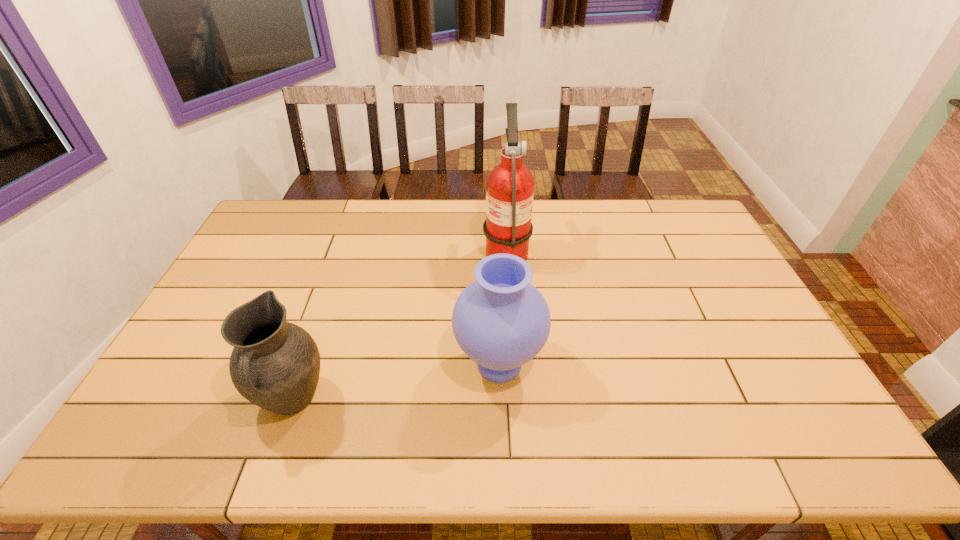
In order to click on blank area at the far edge in this screenshot , I will do `click(560, 215)`.

You are a GUI agent. You are given a task and a screenshot of the screen. Output one action in this format:
    pyautogui.click(x=<x>, y=<y>)
    Task: Click on the free space at the near edge of the desktop
    The image size is (960, 540).
    Given the screenshot: What is the action you would take?
    (x=385, y=427)

I want to click on vacant space at the left edge, so click(x=187, y=391).

This screenshot has width=960, height=540. I want to click on free space at the right edge, so click(x=801, y=415).

Locate an element on the screen. Image resolution: width=960 pixels, height=540 pixels. vacant region at the far left corner of the desktop is located at coordinates (287, 232).

Locate an element on the screen. The height and width of the screenshot is (540, 960). vacant space at the far right corner of the desktop is located at coordinates (663, 222).

Identify the location of blank region between the fire extinguisher and the pitcher. (399, 324).

Where is `free area in between the farthest object and the leftmost object`? The height and width of the screenshot is (540, 960). free area in between the farthest object and the leftmost object is located at coordinates (399, 324).

Identify the location of free space between the tallest object and the leftmost object. (399, 324).

Find the location of a particular element. vacant point located between the vase and the leftmost object is located at coordinates (396, 382).